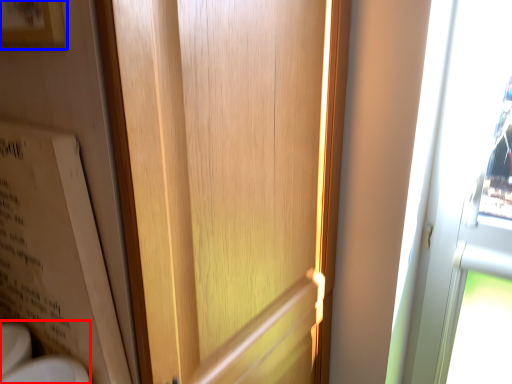
Question: Which point is closer to the camera, sink (highlighted by a red box) or picture frame (highlighted by a blue box)?

Choices:
 (A) sink
 (B) picture frame

Answer: (B)